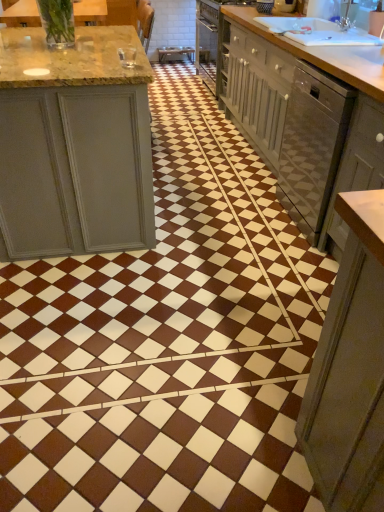
Question: From their relative heights in the image, would you say translucent glass vase at upper left, which appears as the 2th countertop when viewed from the back, is taller or shorter than light brown wood countertop at upper right, which appears as the 2th countertop when viewed from the front?

Choices:
 (A) tall
 (B) short

Answer: (B)

Question: Looking at the image, does translucent glass vase at upper left, which appears as the 2th countertop when viewed from the back, seem bigger or smaller compared to light brown wood countertop at upper right, which is the 1th countertop from back to front?

Choices:
 (A) small
 (B) big

Answer: (A)

Question: Which object is positioned closest to the light brown wood countertop at upper right, which is the 1th countertop from back to front?

Choices:
 (A) matte gray cabinet at right
 (B) white glossy dishwasher at right
 (C) translucent glass vase at upper left, which is the 1th countertop from front to back

Answer: (B)

Question: Estimate the real-world distances between objects in this image. Which object is farther from the white glossy dishwasher at right?

Choices:
 (A) matte gray cabinet at right
 (B) translucent glass vase at upper left, arranged as the 2th countertop when viewed from the right
 (C) light brown wood countertop at upper right, which appears as the 2th countertop when viewed from the front

Answer: (B)